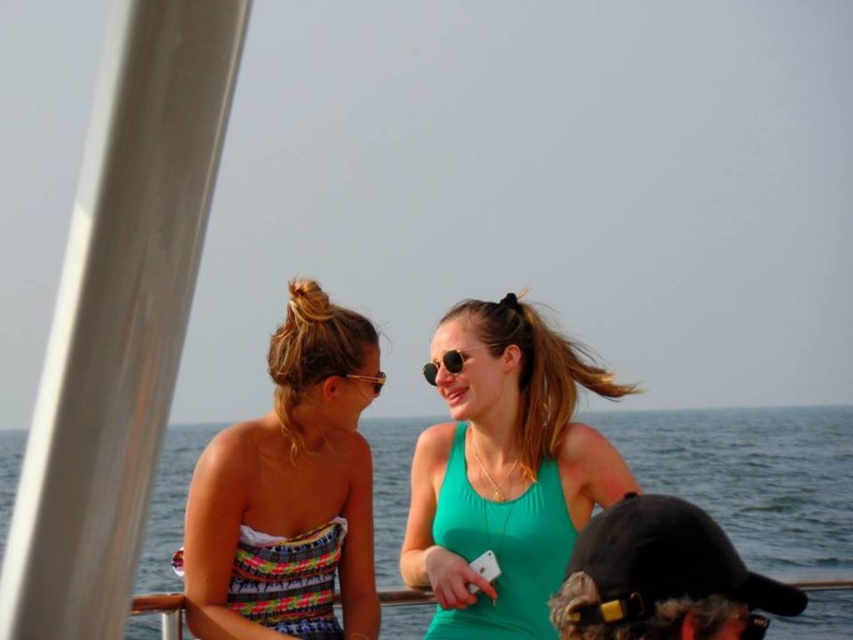
Question: Which point is closer to the camera?

Choices:
 (A) multicolored strapless dress at left
 (B) green matte tank top at center
 (C) black matte baseball cap at lower right
 (D) matte gold goggles at upper center

Answer: (C)

Question: Which object is farther from the camera taking this photo?

Choices:
 (A) sunglasses at center
 (B) multicolored strapless dress at left

Answer: (A)

Question: Which object appears farthest from the camera in this image?

Choices:
 (A) multicolored strapless dress at left
 (B) blue water at center
 (C) black matte baseball cap at lower right

Answer: (A)

Question: Does green matte tank top at center appear on the right side of multicolored strapless dress at left?

Choices:
 (A) no
 (B) yes

Answer: (B)

Question: Does blue water at center lie in front of matte gold goggles at upper center?

Choices:
 (A) no
 (B) yes

Answer: (B)

Question: Does green matte tank top at center appear under blue water at center?

Choices:
 (A) no
 (B) yes

Answer: (A)